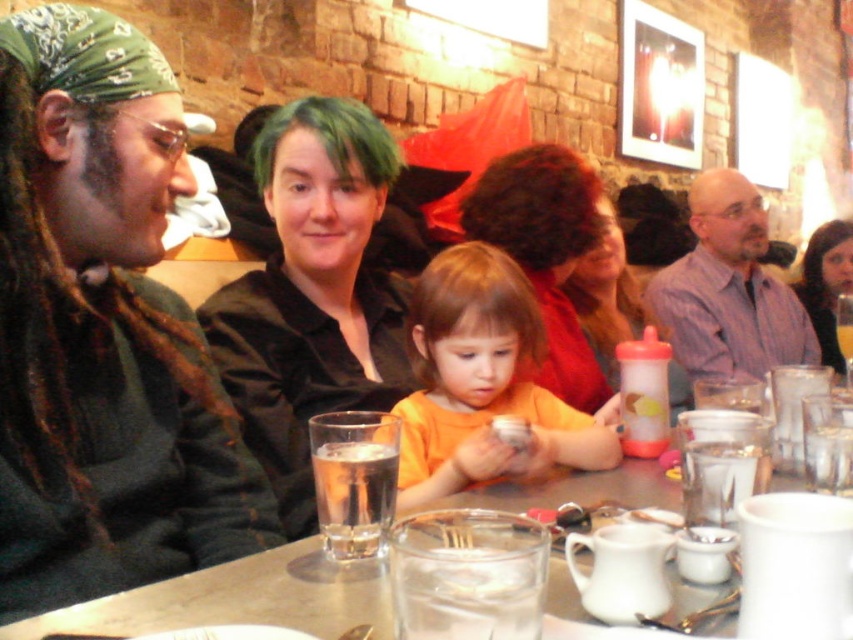
Question: Which object is positioned farthest from the dark curly hair at center?

Choices:
 (A) matte plastic sippy cup at center
 (B) purple shirt at right
 (C) smooth black shirt at center
 (D) brown matte hair at upper right

Answer: (D)

Question: Where is purple shirt at right located in relation to dark curly hair at center in the image?

Choices:
 (A) below
 (B) above

Answer: (A)

Question: Can you confirm if dark curly hair at center is positioned to the left of green matte hair at center?

Choices:
 (A) no
 (B) yes

Answer: (A)

Question: Which point is closer to the camera?

Choices:
 (A) green matte hair at center
 (B) black satin shirt at center

Answer: (B)

Question: Which point is farther to the camera?

Choices:
 (A) (494, 326)
 (B) (106, 406)
 (C) (358, 157)

Answer: (C)

Question: Does orange matte shirt at center appear over matte plastic sippy cup at center?

Choices:
 (A) no
 (B) yes

Answer: (A)